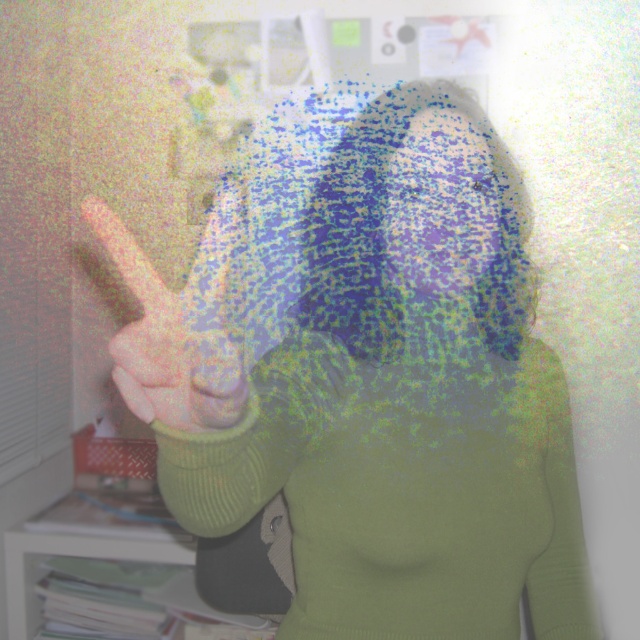
Does green ribbed sweater at center appear on the right side of smooth skin hand at center?

Correct, you'll find green ribbed sweater at center to the right of smooth skin hand at center.

Is green ribbed sweater at center positioned before smooth skin hand at center?

That is False.

I want to click on green ribbed sweater at center, so click(x=369, y=374).

Is point (388, 260) farther from camera compared to point (186, 344)?

Yes, it is.

Between smooth blue fabric at center and smooth skin hand at center, which one has less height?

With less height is smooth skin hand at center.

Is point (442, 243) in front of point (179, 376)?

No, (442, 243) is further to viewer.

Identify the location of smooth blue fabric at center. This screenshot has height=640, width=640. (444, 208).

From the picture: Between green ribbed sweater at center and smooth blue fabric at center, which one has more height?

green ribbed sweater at center

Can you confirm if green ribbed sweater at center is positioned to the right of smooth blue fabric at center?

No, green ribbed sweater at center is not to the right of smooth blue fabric at center.

Is point (259, 179) closer to camera compared to point (477, 196)?

No, (259, 179) is further to viewer.

I want to click on green ribbed sweater at center, so click(369, 374).